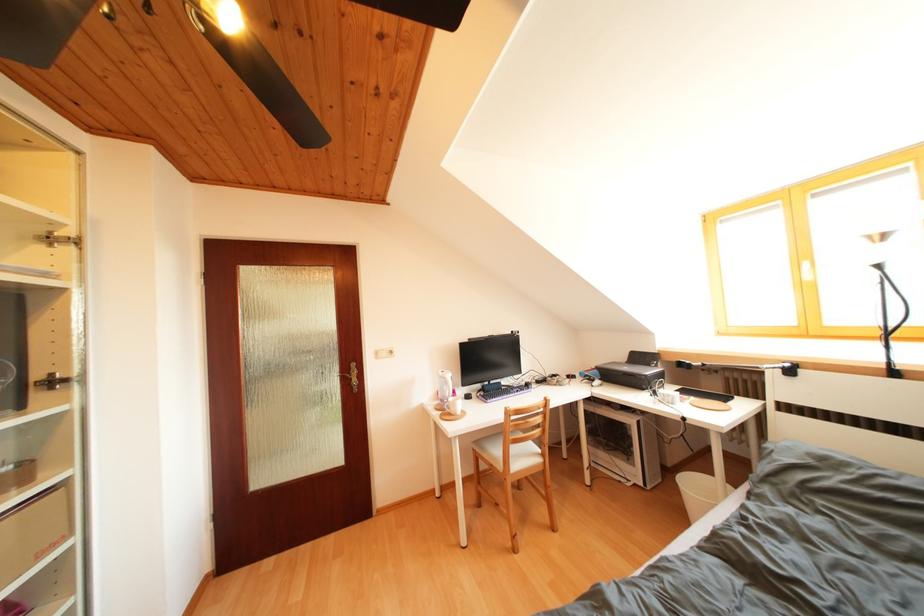
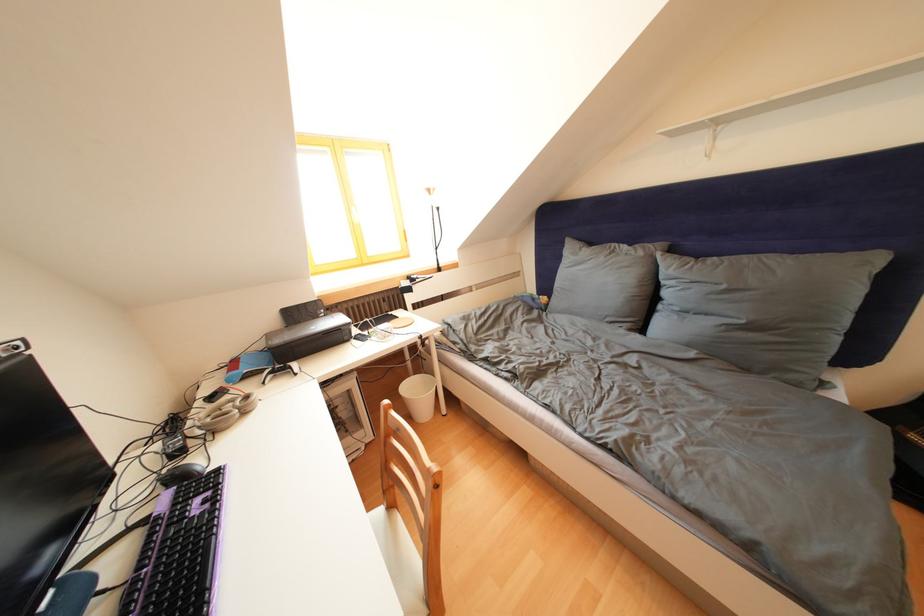
The point at (577,382) is marked in the first image. Where is the corresponding point in the second image?

(220, 403)